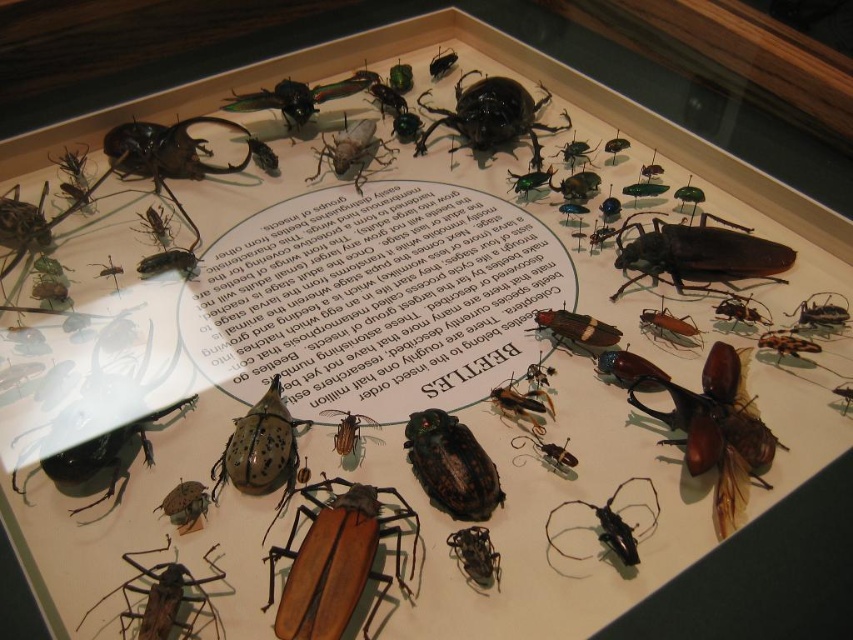
Question: Is brown matte wood at center below shiny brown beetle at center?

Choices:
 (A) yes
 (B) no

Answer: (A)

Question: Can you confirm if shiny metallic beetle at center is bigger than matte black beetle at center?

Choices:
 (A) yes
 (B) no

Answer: (B)

Question: Among these points, which one is nearest to the camera?

Choices:
 (A) (451, 500)
 (B) (548, 312)
 (C) (283, 593)
 (D) (753, 460)

Answer: (C)

Question: Is brown matte wood at center thinner than brown matte beetle at right?

Choices:
 (A) no
 (B) yes

Answer: (B)

Question: Which of these objects is positioned farthest from the brown matte wood at center?

Choices:
 (A) brown glossy beetle at center
 (B) shiny brown beetle at center
 (C) brown matte beetle at lower left

Answer: (B)

Question: Which object is the closest to the brown matte wood at center?

Choices:
 (A) shiny metallic beetle at center
 (B) brown glossy beetle at center

Answer: (A)